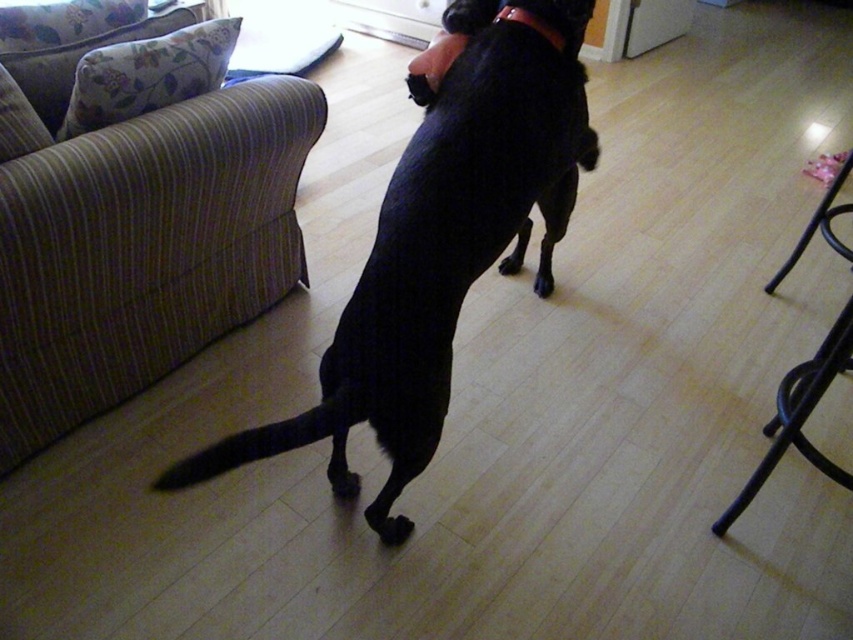
Question: Which point is farther from the camera taking this photo?

Choices:
 (A) (532, 284)
 (B) (297, 419)

Answer: (A)

Question: Does black rubber paw at center appear over black fur paw at center?

Choices:
 (A) no
 (B) yes

Answer: (A)

Question: Can you confirm if black smooth dog at center is smaller than black fur paw at center?

Choices:
 (A) no
 (B) yes

Answer: (A)

Question: Is rubber band at upper center behind black fur paw at center?

Choices:
 (A) yes
 (B) no

Answer: (B)

Question: Which of the following is the farthest from the observer?

Choices:
 (A) (421, 205)
 (B) (511, 268)
 (C) (538, 284)

Answer: (B)

Question: Considering the real-world distances, which object is farthest from the black smooth dog at center?

Choices:
 (A) black fur paw at center
 (B) black rubber paw at center
 (C) rubber band at upper center
 (D) black metal stool at lower right

Answer: (A)